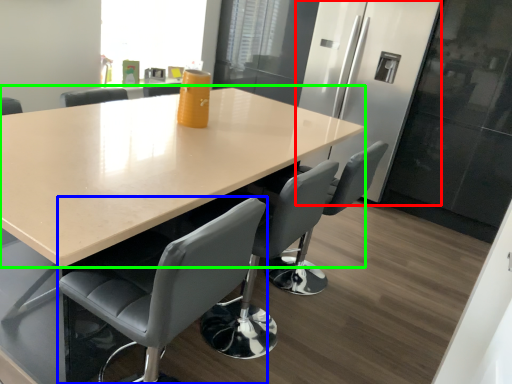
Question: Considering the real-world distances, which object is closest to fridge (highlighted by a red box)? chair (highlighted by a blue box) or table (highlighted by a green box).

Choices:
 (A) chair
 (B) table

Answer: (B)